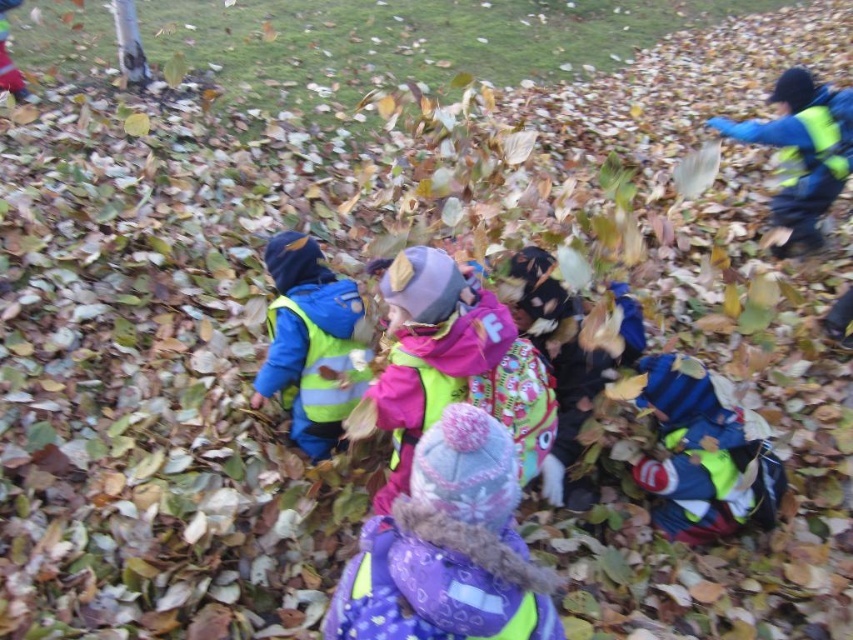
Question: Does vibrant pink fleece at center have a greater width compared to reflective yellow vest at center?

Choices:
 (A) yes
 (B) no

Answer: (A)

Question: Can you confirm if vibrant pink fleece at center is smaller than reflective yellow vest at center?

Choices:
 (A) no
 (B) yes

Answer: (A)

Question: Which point is closer to the camera?

Choices:
 (A) reflective yellow vest at center
 (B) vibrant pink fleece at center

Answer: (B)

Question: Which point is closer to the camera taking this photo?

Choices:
 (A) (351, 388)
 (B) (456, 332)

Answer: (B)

Question: Which object is closer to the camera taking this photo?

Choices:
 (A) vibrant pink fleece at center
 (B) reflective yellow vest at center

Answer: (A)

Question: Where is vibrant pink fleece at center located in relation to reflective yellow vest at center in the image?

Choices:
 (A) above
 (B) below

Answer: (B)